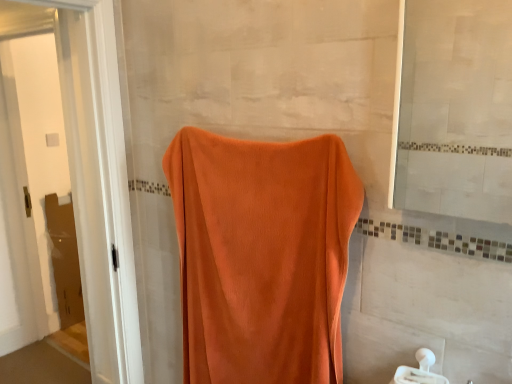
This screenshot has width=512, height=384. What do you see at coordinates (99, 185) in the screenshot?
I see `orange towel at left` at bounding box center [99, 185].

Where is `white plastic towel bar at lower right`? This screenshot has height=384, width=512. white plastic towel bar at lower right is located at coordinates (419, 371).

The height and width of the screenshot is (384, 512). I want to click on orange velvety towel at center, so click(262, 255).

The height and width of the screenshot is (384, 512). What are the coordinates of `orange towel at left` in the screenshot? It's located at (99, 185).

In the image, is orange velvety towel at center on the left side or the right side of orange towel at left?

Based on their positions, orange velvety towel at center is located to the right of orange towel at left.

Which of these two, orange velvety towel at center or orange towel at left, is wider?

orange towel at left is wider.

Looking at this image, from a real-world perspective, is orange velvety towel at center physically located above or below orange towel at left?

From a real-world perspective, orange velvety towel at center is physically below orange towel at left.

Is orange velvety towel at center taller than orange towel at left?

No, orange velvety towel at center is not taller than orange towel at left.

Is white plastic towel bar at lower right to the left of orange towel at left from the viewer's perspective?

In fact, white plastic towel bar at lower right is to the right of orange towel at left.

Is white plastic towel bar at lower right taller than orange towel at left?

No.

Where is `screen door that appears on the left of white plastic towel bar at lower right`? screen door that appears on the left of white plastic towel bar at lower right is located at coordinates (99, 185).

Is white plastic towel bar at lower right looking in the opposite direction of orange towel at left?

No, white plastic towel bar at lower right is not facing away from orange towel at left.

Is white plastic towel bar at lower right aimed at orange velvety towel at center?

No, white plastic towel bar at lower right is not aimed at orange velvety towel at center.

From the image's perspective, is white plastic towel bar at lower right on top of orange velvety towel at center?

No, from the image's perspective, white plastic towel bar at lower right is not on top of orange velvety towel at center.

Between white plastic towel bar at lower right and orange velvety towel at center, which one appears on the right side from the viewer's perspective?

From the viewer's perspective, white plastic towel bar at lower right appears more on the right side.

Considering the sizes of white plastic towel bar at lower right and orange velvety towel at center in the image, is white plastic towel bar at lower right wider or thinner than orange velvety towel at center?

In the image, white plastic towel bar at lower right appears to be wider than orange velvety towel at center.

Which object is thinner, matte glass mirror at upper right or white plastic towel bar at lower right?

Thinner between the two is white plastic towel bar at lower right.

Is matte glass mirror at upper right completely or partially outside of white plastic towel bar at lower right?

Indeed, matte glass mirror at upper right is completely outside white plastic towel bar at lower right.

Is matte glass mirror at upper right touching white plastic towel bar at lower right?

matte glass mirror at upper right is not next to white plastic towel bar at lower right, and they're not touching.

Considering the sizes of objects orange velvety towel at center and matte glass mirror at upper right in the image provided, who is smaller, orange velvety towel at center or matte glass mirror at upper right?

matte glass mirror at upper right is smaller.

Is orange velvety towel at center directly adjacent to matte glass mirror at upper right?

No.

The height and width of the screenshot is (384, 512). Find the location of `mirror that is in front of the orange velvety towel at center`. mirror that is in front of the orange velvety towel at center is located at coordinates (454, 109).

From a real-world perspective, is matte glass mirror at upper right physically above orange towel at left?

Yes.

Does matte glass mirror at upper right lie in front of orange towel at left?

Yes.

Does matte glass mirror at upper right turn towards orange towel at left?

No, matte glass mirror at upper right does not turn towards orange towel at left.

Is orange velvety towel at center surrounded by orange towel at left?

No, orange velvety towel at center is located outside of orange towel at left.

Is orange towel at left turned away from orange velvety towel at center?

orange towel at left is not turned away from orange velvety towel at center.

Is orange towel at left at the right side of orange velvety towel at center?

No, orange towel at left is not to the right of orange velvety towel at center.

Is orange towel at left bigger than orange velvety towel at center?

Correct, orange towel at left is larger in size than orange velvety towel at center.

You are a GUI agent. You are given a task and a screenshot of the screen. Output one action in this format:
    pyautogui.click(x=<x>, y=<y>)
    Task: Click on the screen door above the orange velvety towel at center (from a real-world perspective)
    The image size is (512, 384).
    Given the screenshot: What is the action you would take?
    pyautogui.click(x=99, y=185)

The image size is (512, 384). Find the location of `screen door above the white plastic towel bar at lower right (from the image's perspective)`. screen door above the white plastic towel bar at lower right (from the image's perspective) is located at coordinates (99, 185).

From the image, which object appears to be farther from orange velvety towel at center, matte glass mirror at upper right or orange towel at left?

orange towel at left lies further to orange velvety towel at center than the other object.

Looking at this image, when comparing their distances from white plastic towel bar at lower right, does orange velvety towel at center or orange towel at left seem closer?

Among the two, orange velvety towel at center is located nearer to white plastic towel bar at lower right.

Which object lies nearer to the anchor point orange towel at left, white plastic towel bar at lower right or orange velvety towel at center?

orange velvety towel at center.

Considering their positions, is white plastic towel bar at lower right positioned further to matte glass mirror at upper right than orange towel at left?

The object further to matte glass mirror at upper right is orange towel at left.

Looking at the image, which one is located further to orange towel at left, white plastic towel bar at lower right or matte glass mirror at upper right?

Based on the image, white plastic towel bar at lower right appears to be further to orange towel at left.

Considering their positions, is white plastic towel bar at lower right positioned further to orange velvety towel at center than orange towel at left?

orange towel at left.

Considering their positions, is orange velvety towel at center positioned further to orange towel at left than matte glass mirror at upper right?

The object further to orange towel at left is matte glass mirror at upper right.

Estimate the real-world distances between objects in this image. Which object is closer to white plastic towel bar at lower right, orange towel at left or matte glass mirror at upper right?

matte glass mirror at upper right is closer to white plastic towel bar at lower right.

This screenshot has width=512, height=384. What are the coordinates of `towel between orange towel at left and white plastic towel bar at lower right from left to right` in the screenshot? It's located at (262, 255).

Identify the location of towel between orange towel at left and matte glass mirror at upper right. The height and width of the screenshot is (384, 512). (262, 255).

Locate an element on the screen. The image size is (512, 384). towel bar situated between orange towel at left and matte glass mirror at upper right from left to right is located at coordinates (419, 371).

Where is `towel between matte glass mirror at upper right and white plastic towel bar at lower right in the up-down direction`? This screenshot has width=512, height=384. towel between matte glass mirror at upper right and white plastic towel bar at lower right in the up-down direction is located at coordinates (262, 255).